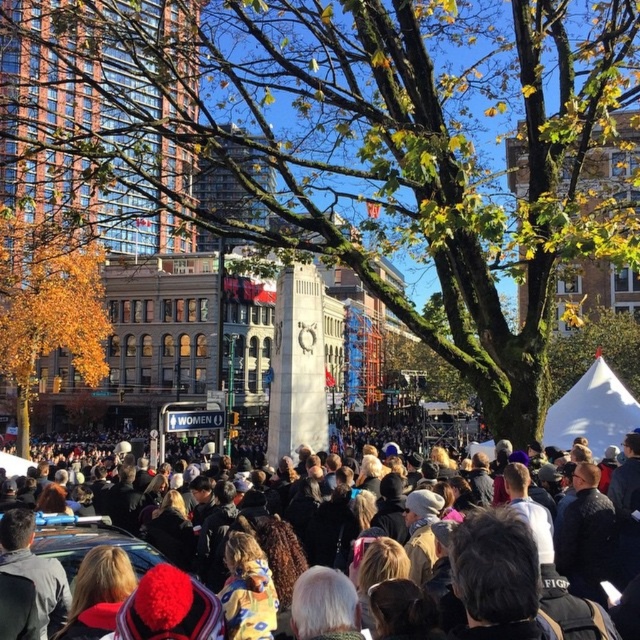
Question: Which object appears closest to the camera in this image?

Choices:
 (A) golden leaves at left
 (B) green mossy tree at center
 (C) dark brown fur coat at center

Answer: (C)

Question: Does green mossy tree at center appear on the right side of dark brown fur coat at center?

Choices:
 (A) yes
 (B) no

Answer: (B)

Question: Does golden leaves at left appear on the left side of dark brown fur coat at center?

Choices:
 (A) yes
 (B) no

Answer: (A)

Question: Which of the following is the closest to the observer?

Choices:
 (A) golden leaves at left
 (B) green mossy tree at center

Answer: (B)

Question: In this image, where is golden leaves at left located relative to dark brown fur coat at center?

Choices:
 (A) left
 (B) right

Answer: (A)

Question: Which object appears closest to the camera in this image?

Choices:
 (A) golden leaves at left
 (B) green mossy tree at center

Answer: (B)